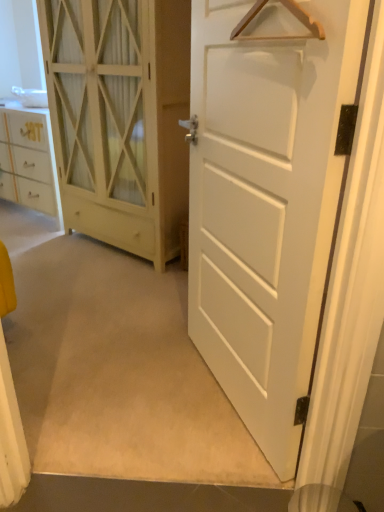
Question: Is wooden hanger at upper center situated inside white matte door at center, which appears as the 1th door when viewed from the front, or outside?

Choices:
 (A) outside
 (B) inside

Answer: (B)

Question: In terms of size, does wooden hanger at upper center appear bigger or smaller than white matte door at center, which appears as the 1th door when viewed from the front?

Choices:
 (A) small
 (B) big

Answer: (A)

Question: Which of these objects is positioned farthest from the white wood cabinet at left, the 2th door viewed from the front?

Choices:
 (A) wooden hanger at upper center
 (B) white matte door at center, the second door from the back

Answer: (A)

Question: Estimate the real-world distances between objects in this image. Which object is farther from the wooden hanger at upper center?

Choices:
 (A) white matte door at center, the second door from the back
 (B) white wood cabinet at left, the 2th door viewed from the front

Answer: (B)